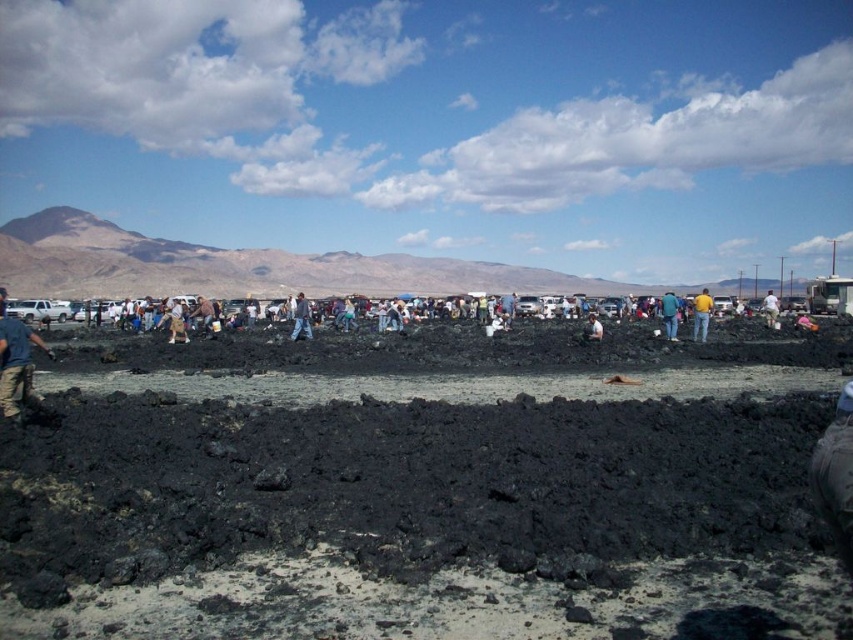
Between black volcanic mud at center and brown leather jacket at center, which one is positioned higher?

Positioned higher is brown leather jacket at center.

Is black volcanic mud at center to the left of brown leather jacket at center from the viewer's perspective?

No, black volcanic mud at center is not to the left of brown leather jacket at center.

Image resolution: width=853 pixels, height=640 pixels. What do you see at coordinates (418, 497) in the screenshot?
I see `black volcanic mud at center` at bounding box center [418, 497].

Image resolution: width=853 pixels, height=640 pixels. In order to click on black volcanic mud at center in this screenshot , I will do `click(418, 497)`.

Looking at this image, who is more forward, (x=41, y=340) or (x=207, y=300)?

Positioned in front is point (x=41, y=340).

Can you confirm if blue jeans at lower left is smaller than brown leather jacket at center?

Correct, blue jeans at lower left occupies less space than brown leather jacket at center.

Is point (10, 326) positioned in front of point (206, 321)?

Yes, it is in front of point (206, 321).

Where is `blue jeans at lower left`? This screenshot has width=853, height=640. blue jeans at lower left is located at coordinates (16, 364).

Is point (703, 321) farther from viewer compared to point (675, 305)?

No, it is in front of (675, 305).

Does point (704, 333) lie behind point (666, 317)?

No.

The width and height of the screenshot is (853, 640). Identify the location of yellow shirt at center. [701, 314].